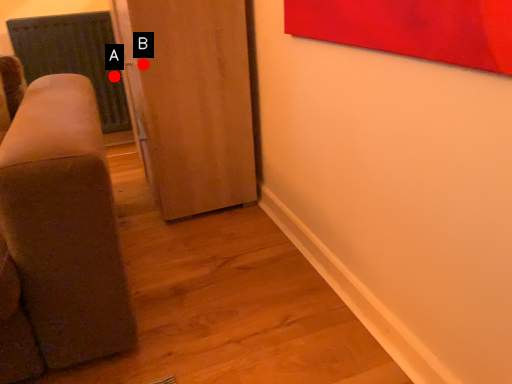
Question: Two points are circled on the image, labeled by A and B beside each circle. Which point is closer to the camera?

Choices:
 (A) A is closer
 (B) B is closer

Answer: (B)